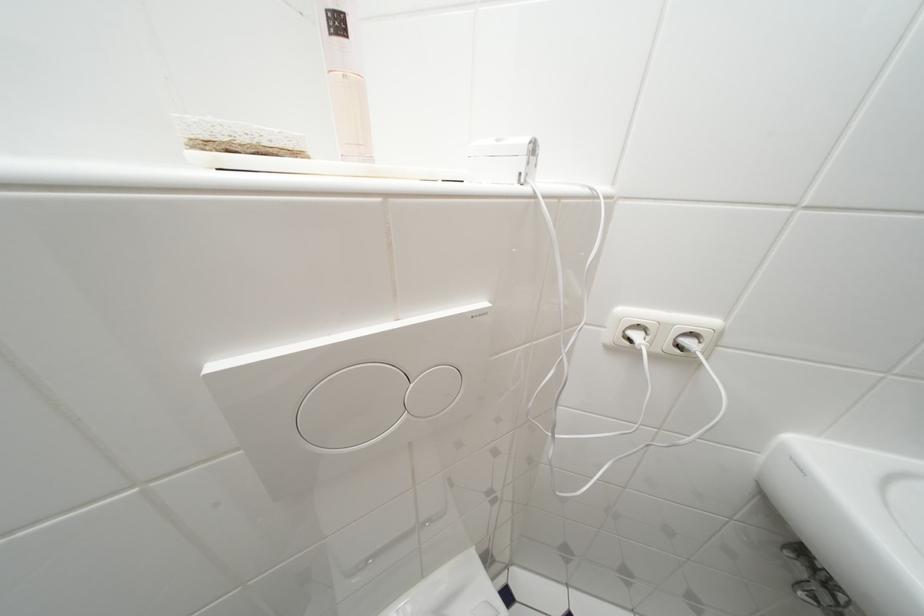
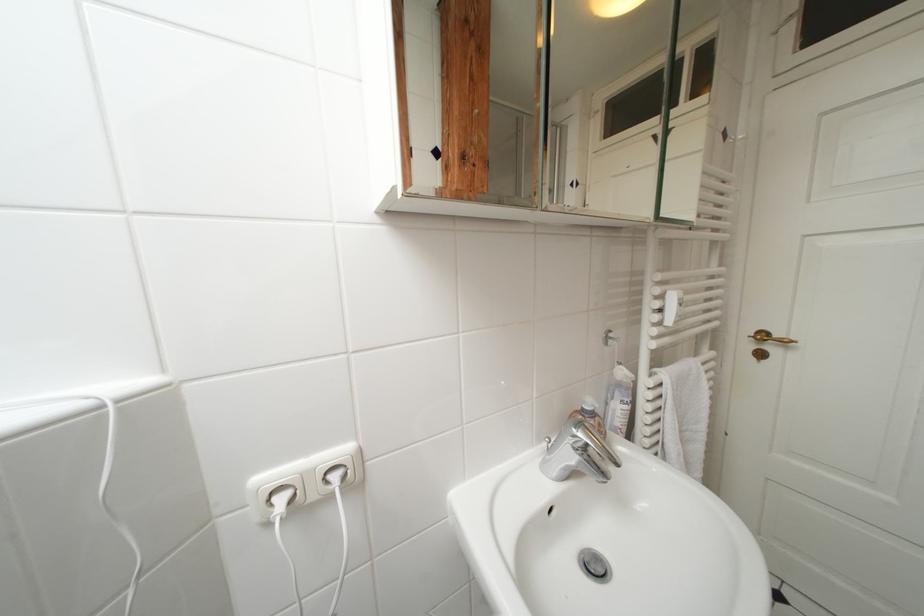
Question: The first image is from the beginning of the video and the second image is from the end. How did the camera likely rotate when shooting the video?

Choices:
 (A) Left
 (B) Right
 (C) Up
 (D) Down

Answer: (B)